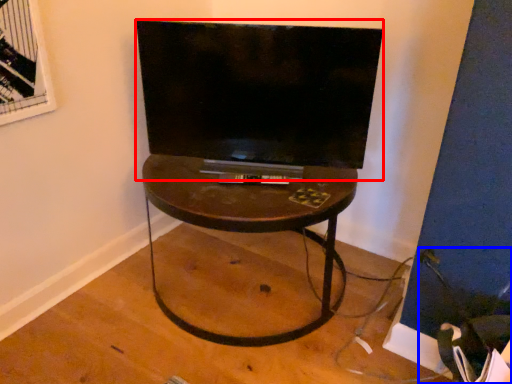
Question: Which point is further to the camera, television (highlighted by a red box) or swivel chair (highlighted by a blue box)?

Choices:
 (A) television
 (B) swivel chair

Answer: (A)